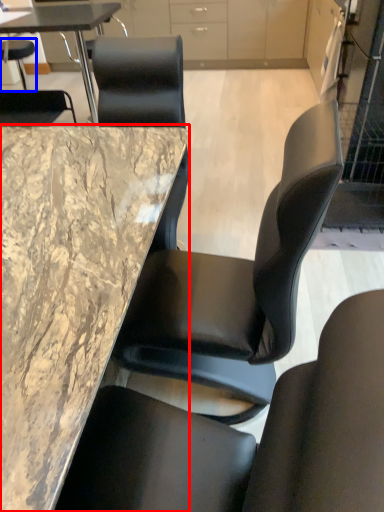
Question: Which object appears farthest to the camera in this image, table (highlighted by a red box) or chair (highlighted by a blue box)?

Choices:
 (A) table
 (B) chair

Answer: (B)